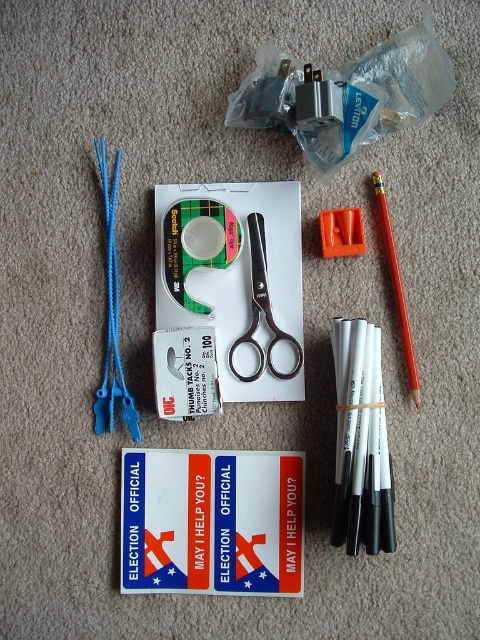
You are organizing items on a desk and need to place a new item between the white matte pencil at right and the silver metallic scissors at center. What is the minimum width this new item must have to fit between them?

The minimum width the new item must have is 5.71 inches to fit between the white matte pencil at right and the silver metallic scissors at center.

You are organizing office supplies and need to place the white matte pencil at right and the blue plastic ties at left into a drawer. The drawer has a height limit of 5 cm. Can both items fit vertically in the drawer?

The white matte pencil at right is shorter than the blue plastic ties at left. Since the blue plastic ties at left are taller than 5 cm, the pencil might fit, but the ties may not. However, without knowing the exact height of the pencil, we can only confirm the pencil is shorter than the ties. If the ties exceed 5 cm, they won

You are organizing a desk and need to place the green matte tape at center and the orange plastic pencil at right into a drawer. The drawer has a height limit of 5 cm. Can both items fit vertically in the drawer?

The green matte tape at center has a smaller size compared to orange plastic pencil at right. However, without specific height measurements for each item, it is impossible to determine if they can fit vertically in the drawer with a 5 cm height limit.